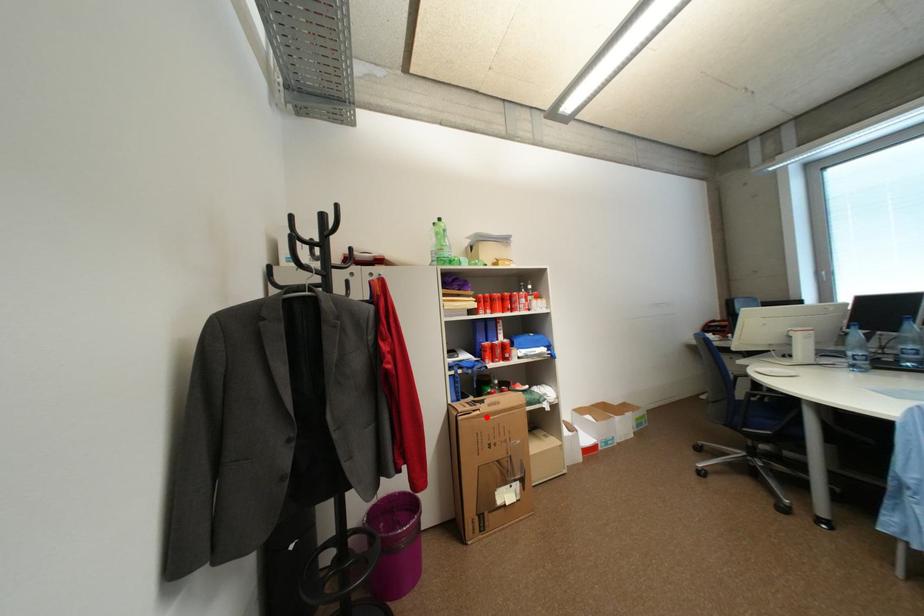
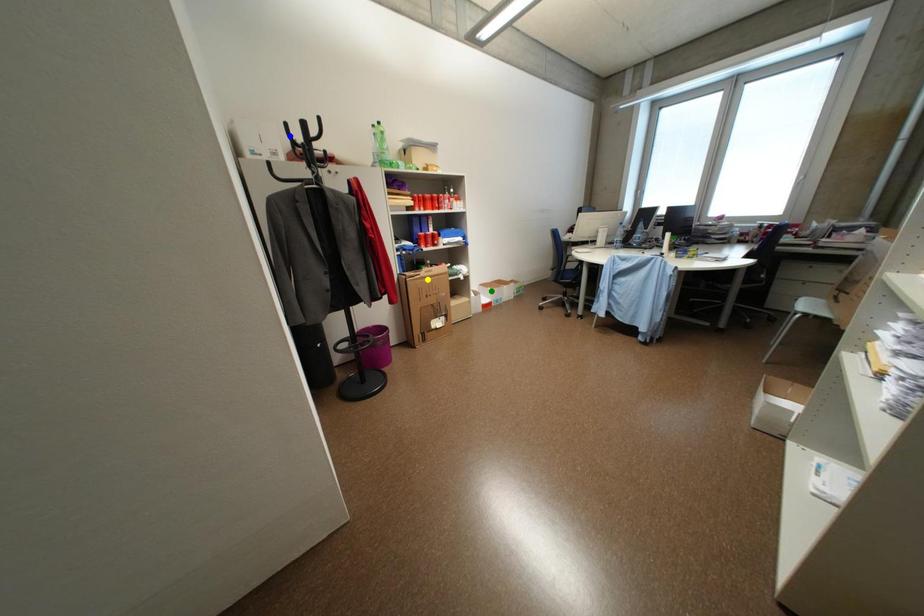
Question: I am providing you with two images of the same scene from different viewpoints. A red point is marked on the first image. You are given multiple points on the second image. Which spot in image 2 lines up with the point in image 1?

Choices:
 (A) green point
 (B) blue point
 (C) yellow point

Answer: (C)